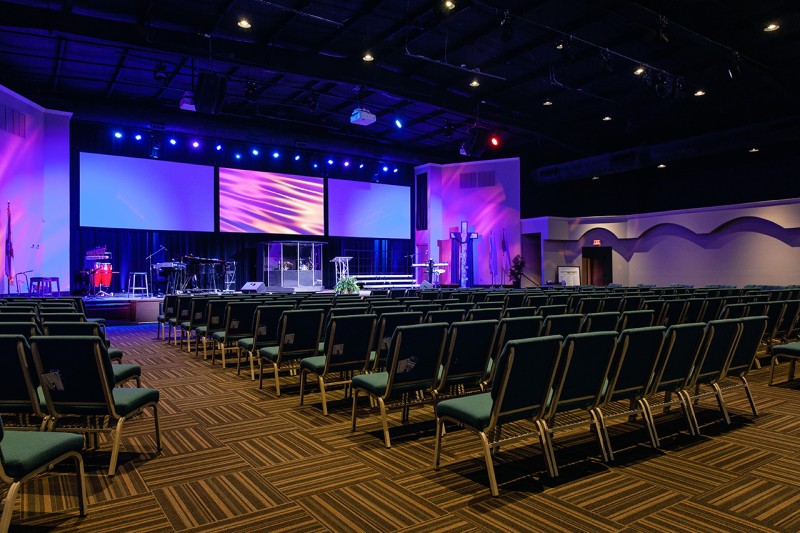
Where is `floor`? This screenshot has height=533, width=800. floor is located at coordinates (418, 468).